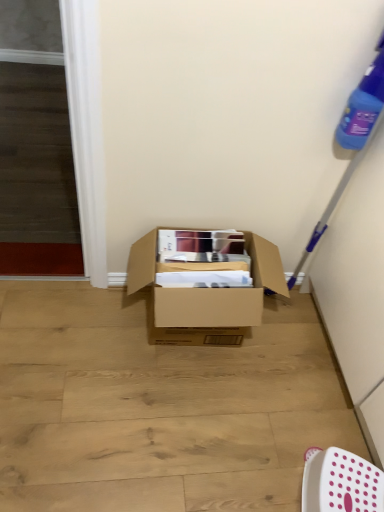
Question: Considering the relative sizes of brown cardboard box at center and white plastic chair at lower right in the image provided, is brown cardboard box at center bigger than white plastic chair at lower right?

Choices:
 (A) yes
 (B) no

Answer: (A)

Question: Is brown cardboard box at center wider than white plastic chair at lower right?

Choices:
 (A) yes
 (B) no

Answer: (A)

Question: From a real-world perspective, is brown cardboard box at center on white plastic chair at lower right?

Choices:
 (A) yes
 (B) no

Answer: (A)

Question: Can you confirm if brown cardboard box at center is shorter than white plastic chair at lower right?

Choices:
 (A) no
 (B) yes

Answer: (A)

Question: Considering the relative positions of brown cardboard box at center and white plastic chair at lower right in the image provided, is brown cardboard box at center to the left of white plastic chair at lower right from the viewer's perspective?

Choices:
 (A) yes
 (B) no

Answer: (A)

Question: Does brown cardboard box at center appear on the right side of white plastic chair at lower right?

Choices:
 (A) no
 (B) yes

Answer: (A)

Question: Is white plastic chair at lower right at the left side of brown cardboard box at center?

Choices:
 (A) yes
 (B) no

Answer: (B)

Question: Is white plastic chair at lower right positioned in front of brown cardboard box at center?

Choices:
 (A) yes
 (B) no

Answer: (A)

Question: Is white plastic chair at lower right smaller than brown cardboard box at center?

Choices:
 (A) no
 (B) yes

Answer: (B)

Question: Can you confirm if white plastic chair at lower right is taller than brown cardboard box at center?

Choices:
 (A) no
 (B) yes

Answer: (A)

Question: From a real-world perspective, does white plastic chair at lower right sit lower than brown cardboard box at center?

Choices:
 (A) yes
 (B) no

Answer: (A)

Question: Is white plastic chair at lower right with brown cardboard box at center?

Choices:
 (A) yes
 (B) no

Answer: (B)

Question: Is white plastic chair at lower right inside the boundaries of brown cardboard box at center, or outside?

Choices:
 (A) outside
 (B) inside

Answer: (A)